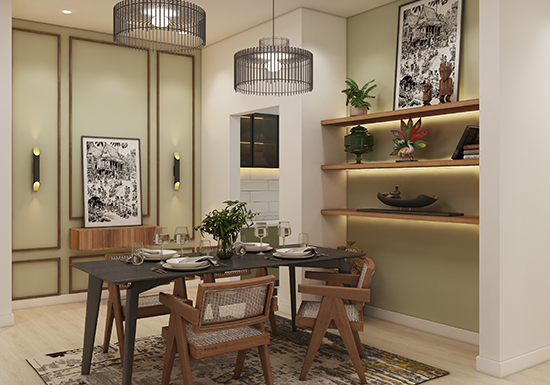
You are a GUI agent. You are given a task and a screenshot of the screen. Output one action in this format:
    pyautogui.click(x=<x>, y=<y>)
    Task: Click on the shelves
    This screenshot has width=550, height=385.
    Given the screenshot: What is the action you would take?
    pyautogui.click(x=447, y=216), pyautogui.click(x=447, y=165), pyautogui.click(x=455, y=108)